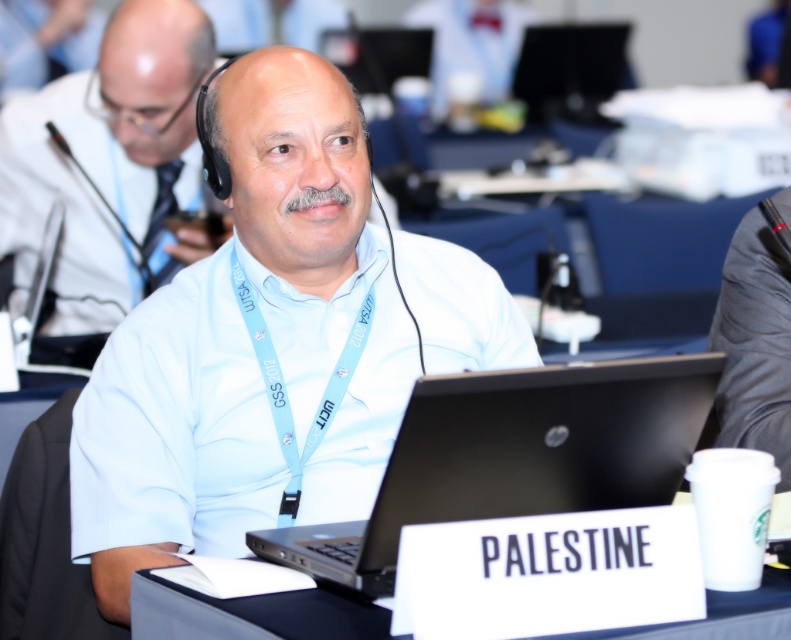
Question: Can you confirm if light blue shirt at center is thinner than black plastic table at center?

Choices:
 (A) yes
 (B) no

Answer: (B)

Question: Is black matte laptop at center to the left of gray fabric suit at right from the viewer's perspective?

Choices:
 (A) no
 (B) yes

Answer: (B)

Question: Based on their relative distances, which object is nearer to the light blue shirt at center?

Choices:
 (A) gray fabric suit at right
 (B) black matte laptop at center
 (C) white matte shirt at center

Answer: (B)

Question: Which of the following is the closest to the observer?

Choices:
 (A) light blue fabric lanyard at center
 (B) gray fabric suit at right
 (C) black matte laptop at center
 (D) black plastic table at center

Answer: (C)

Question: Is black matte laptop at center below white matte shirt at center?

Choices:
 (A) yes
 (B) no

Answer: (A)

Question: Which object is positioned closest to the black plastic table at center?

Choices:
 (A) gray fabric suit at right
 (B) light blue shirt at center

Answer: (B)